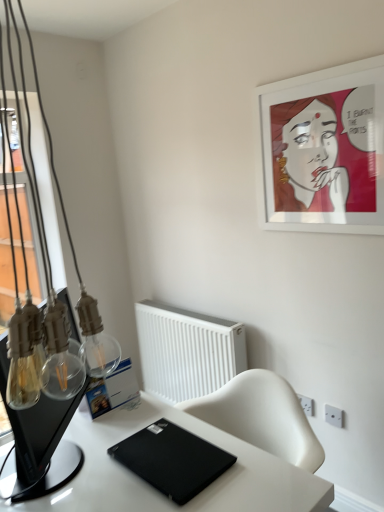
Question: Is white plastic radiator at center inside or outside of white matte picture frame at upper right?

Choices:
 (A) inside
 (B) outside

Answer: (B)

Question: Considering the relative positions of white plastic radiator at center and white matte picture frame at upper right in the image provided, is white plastic radiator at center to the left or to the right of white matte picture frame at upper right?

Choices:
 (A) right
 (B) left

Answer: (B)

Question: Estimate the real-world distances between objects in this image. Which object is farther from the white matte picture frame at upper right?

Choices:
 (A) transparent glass monitor at left
 (B) black matte laptop at lower center
 (C) white glossy desk at center
 (D) white plastic radiator at center

Answer: (A)

Question: Which of these objects is positioned closest to the white plastic radiator at center?

Choices:
 (A) white matte picture frame at upper right
 (B) transparent glass monitor at left
 (C) white glossy desk at center
 (D) black matte laptop at lower center

Answer: (C)